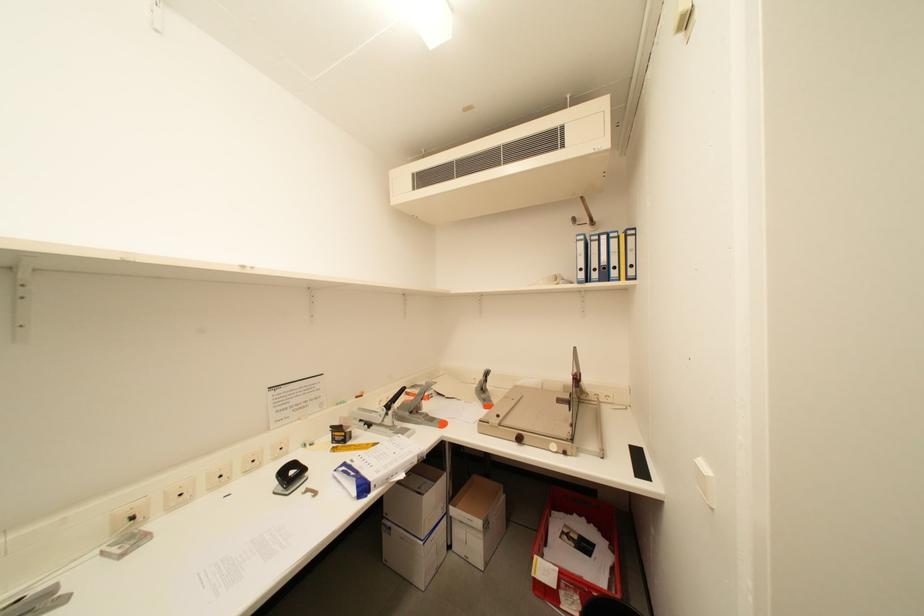
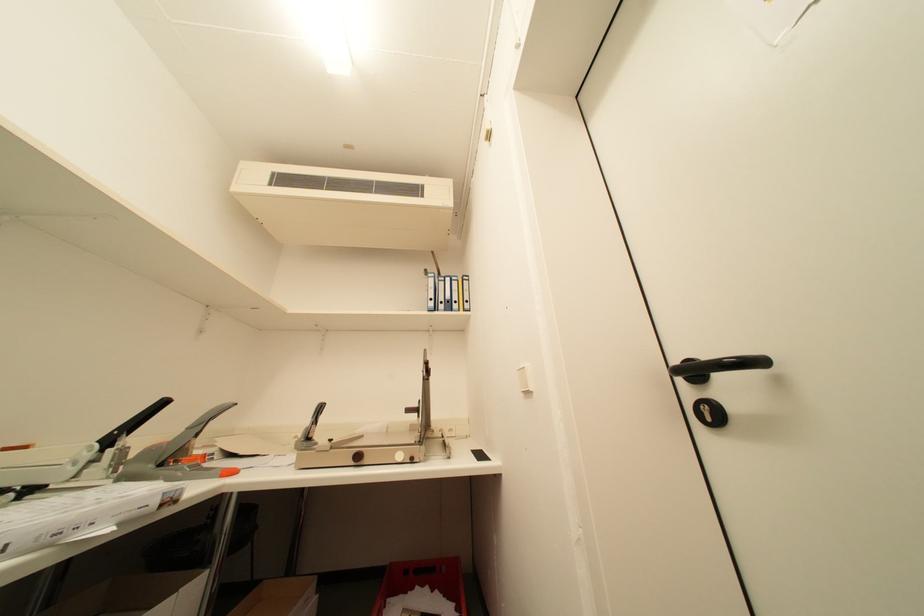
The first image is from the beginning of the video and the second image is from the end. How did the camera likely rotate when shooting the video?

The camera's rotation is toward right-up.